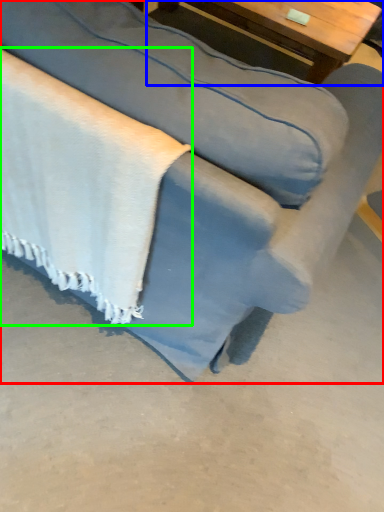
Question: Based on their relative distances, which object is farther from studio couch (highlighted by a red box)? Choose from table (highlighted by a blue box) and blanket (highlighted by a green box).

Choices:
 (A) table
 (B) blanket

Answer: (A)